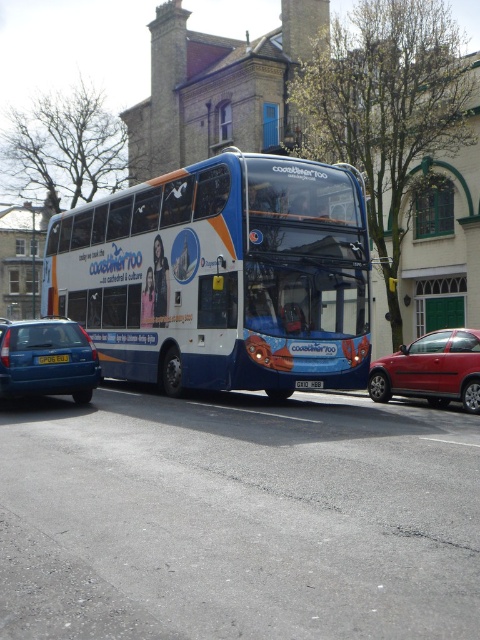
Question: Among these points, which one is farthest from the camera?

Choices:
 (A) (17, 340)
 (B) (38, 364)
 (C) (236, 378)
 (D) (299, 384)

Answer: (D)

Question: In this image, where is metallic red sedan at right located relative to yellow plastic license plate at center?

Choices:
 (A) left
 (B) right

Answer: (B)

Question: Does blue metallic bus at center appear on the left side of metallic blue sedan at left?

Choices:
 (A) yes
 (B) no

Answer: (B)

Question: Which point appears closest to the camera in this image?

Choices:
 (A) (11, 388)
 (B) (61, 356)
 (C) (211, 291)
 (D) (316, 381)

Answer: (A)

Question: Can you confirm if metallic red sedan at right is positioned above white plastic license plate at center?

Choices:
 (A) yes
 (B) no

Answer: (A)

Question: Among these points, which one is nearest to the camera?

Choices:
 (A) (59, 358)
 (B) (33, 324)
 (C) (348, 376)

Answer: (A)